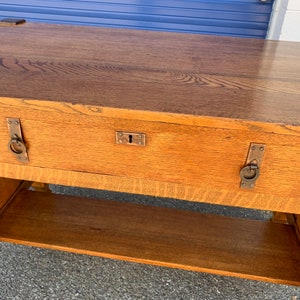
Locate an element on the screen. nice wood top is located at coordinates point(65,48).